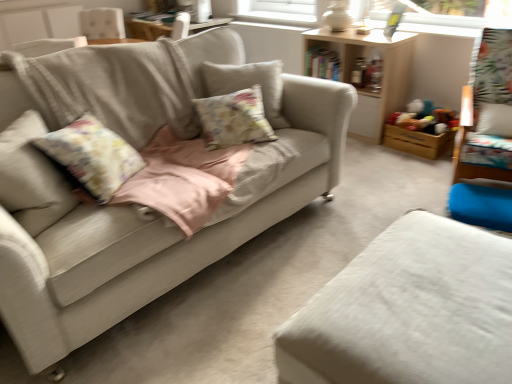
Question: Based on their positions, is wooden toy box at right located to the left or right of fluffy fabric pillow at center?

Choices:
 (A) right
 (B) left

Answer: (A)

Question: Is wooden toy box at right wider or thinner than fluffy fabric pillow at center?

Choices:
 (A) wide
 (B) thin

Answer: (A)

Question: Which object is positioned closest to the wooden shelf at upper center?

Choices:
 (A) fluffy fabric pillow at center
 (B) wooden toy box at right
 (C) white fabric ottoman at lower right, positioned as the first studio couch in right-to-left order
 (D) light beige fabric couch at center, the 1th studio couch viewed from the left
 (E) wooden swivel chair at right

Answer: (B)

Question: Based on their relative distances, which object is nearer to the fluffy fabric pillow at center?

Choices:
 (A) wooden swivel chair at right
 (B) white fabric ottoman at lower right, positioned as the first studio couch in right-to-left order
 (C) light beige fabric couch at center, the 1th studio couch viewed from the left
 (D) wooden shelf at upper center
 (E) wooden toy box at right

Answer: (C)